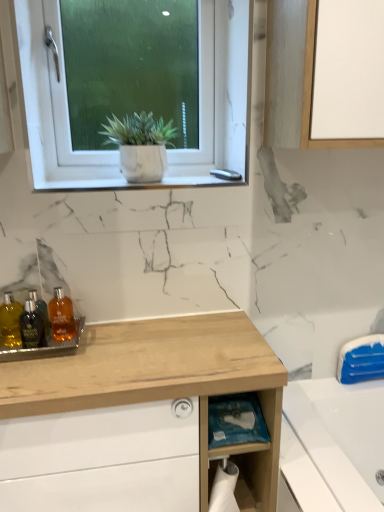
You are a GUI agent. You are given a task and a screenshot of the screen. Output one action in this format:
    pyautogui.click(x=<x>, y=<y>)
    Task: Click on the vacant area to the right of translucent amber bottle at center, placed as the third toiletry when sorted from left to right
    The height and width of the screenshot is (512, 384).
    Given the screenshot: What is the action you would take?
    pyautogui.click(x=126, y=341)